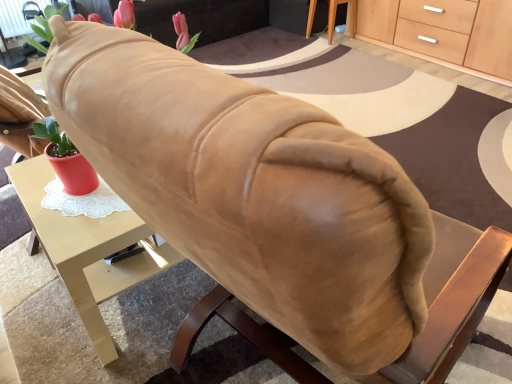
The width and height of the screenshot is (512, 384). Find the location of `vacant region to the left of matte gold desk at center`. vacant region to the left of matte gold desk at center is located at coordinates (35, 291).